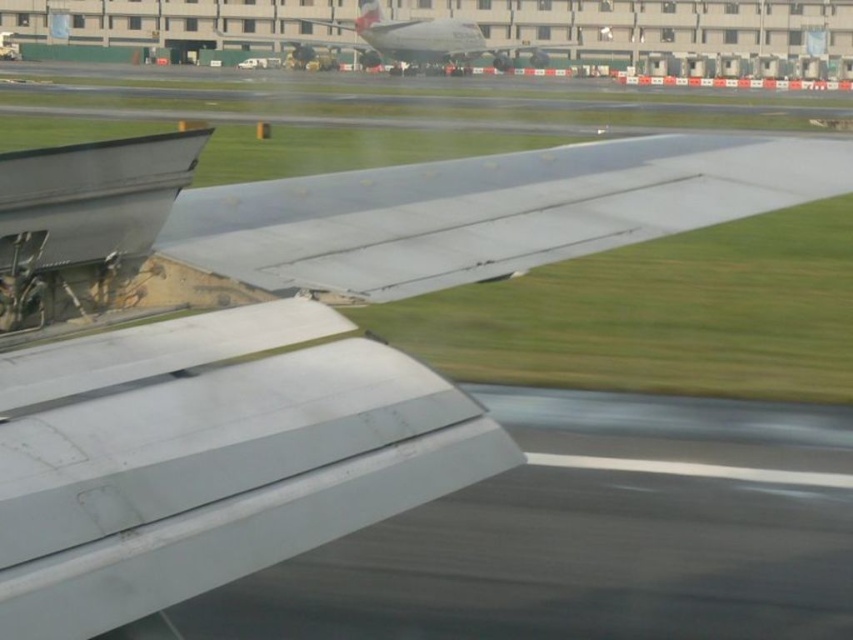
Question: Is metallic gray winglet at lower left closer to the viewer compared to metallic gray wing at center?

Choices:
 (A) no
 (B) yes

Answer: (B)

Question: Considering the real-world distances, which object is farthest from the white glossy airplane at center?

Choices:
 (A) metallic gray winglet at lower left
 (B) metallic gray wing at center
 (C) gray matte tarmac at lower left

Answer: (B)

Question: Based on their relative distances, which object is farther from the white glossy airplane at center?

Choices:
 (A) gray matte tarmac at lower left
 (B) metallic gray wing at center

Answer: (B)

Question: Can you confirm if gray matte tarmac at lower left is positioned to the right of metallic gray wing at center?

Choices:
 (A) yes
 (B) no

Answer: (A)

Question: Which point is closer to the camera taking this photo?

Choices:
 (A) (422, 26)
 (B) (300, 308)
 (C) (589, 227)
 (D) (428, 550)

Answer: (B)

Question: Is metallic gray wing at center closer to camera compared to white glossy airplane at center?

Choices:
 (A) yes
 (B) no

Answer: (A)